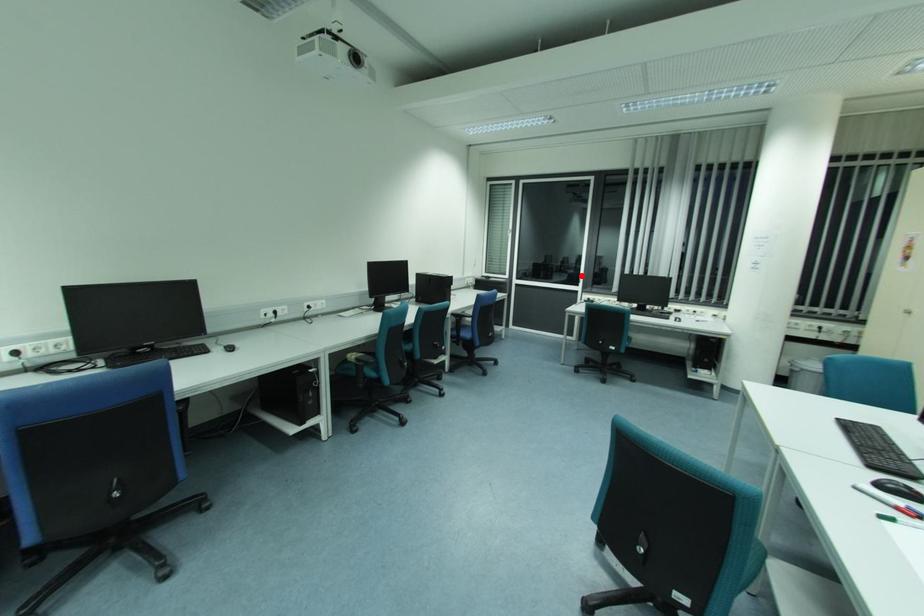
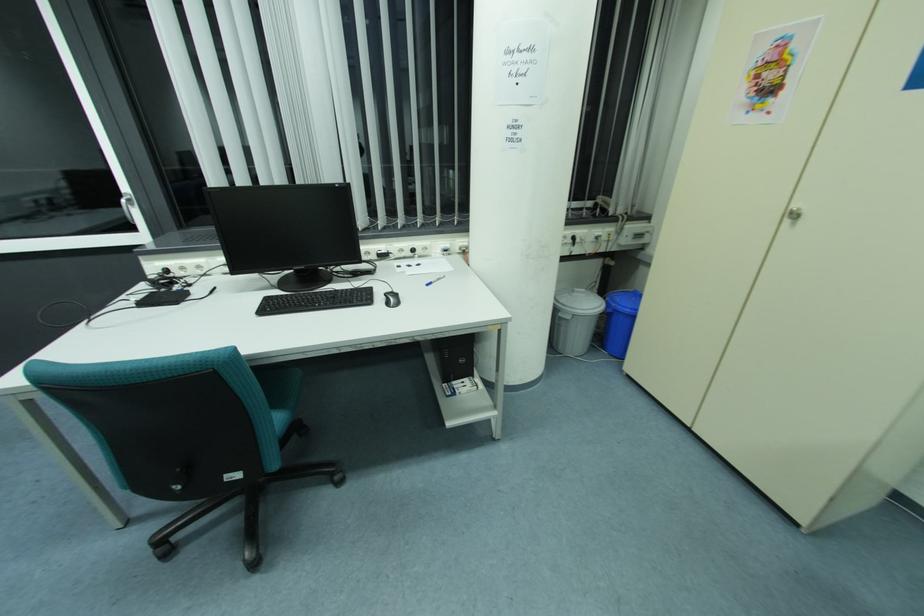
The point at the highlighted location is marked in the first image. Where is the corresponding point in the second image?

(125, 201)